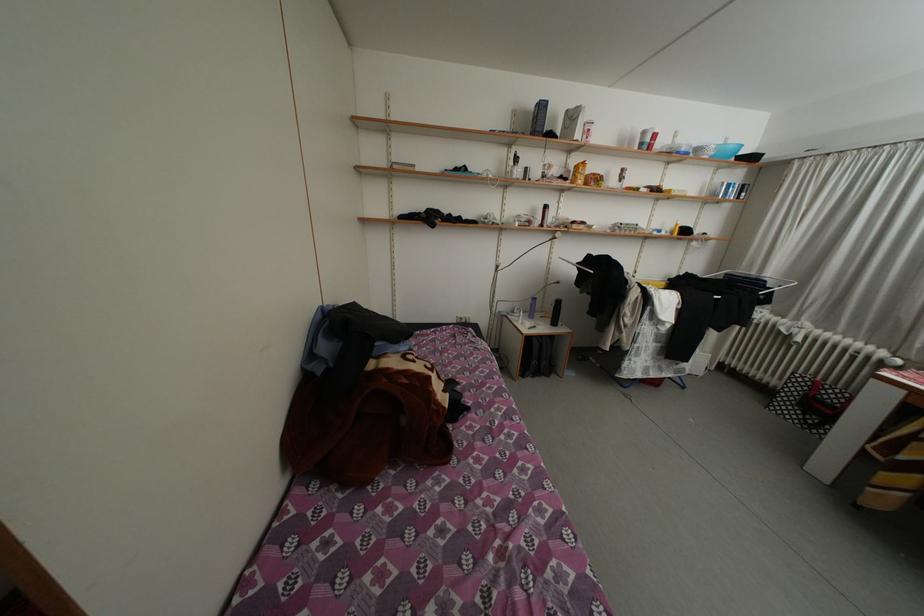
The location [555,312] corresponds to which object?

This point indicates the black speaker bottle.